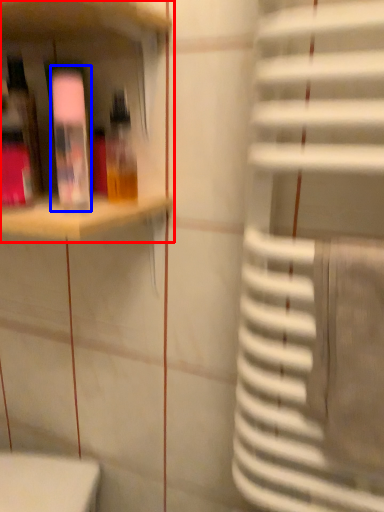
Question: Which object is closer to the camera taking this photo, shelf (highlighted by a red box) or bottle (highlighted by a blue box)?

Choices:
 (A) shelf
 (B) bottle

Answer: (A)